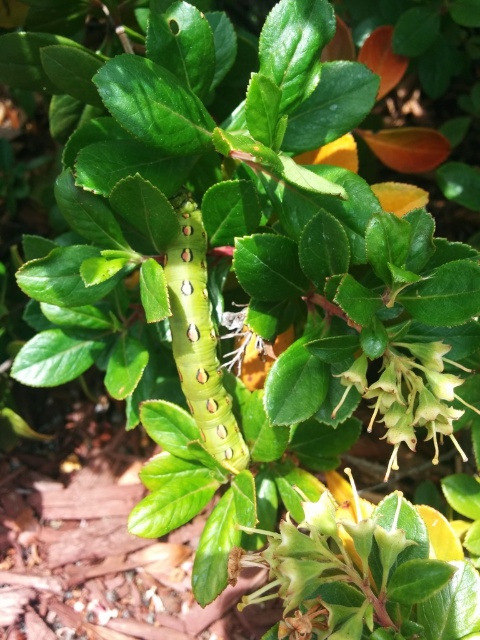
In the scene shown: Can you confirm if green matte caterpillar at center is positioned below white matte flower at center?

Incorrect, green matte caterpillar at center is not positioned below white matte flower at center.

Is point (212, 358) positioned after point (377, 388)?

Yes, point (212, 358) is behind point (377, 388).

You are a GUI agent. You are given a task and a screenshot of the screen. Output one action in this format:
    pyautogui.click(x=<x>, y=<y>)
    Task: Click on the green matte caterpillar at center
    This screenshot has width=480, height=640.
    Given the screenshot: What is the action you would take?
    pyautogui.click(x=199, y=339)

Locate an element on the screen. green matte caterpillar at center is located at coordinates (199, 339).